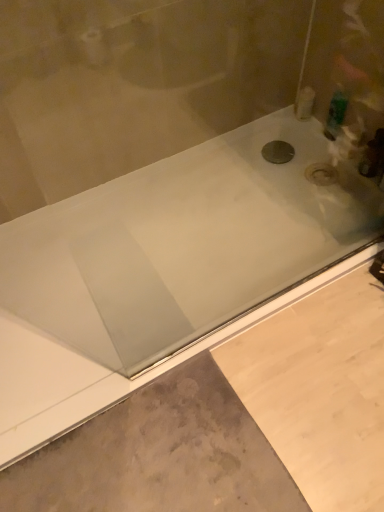
The image size is (384, 512). Identify the location of free space to the left of black metallic drain at center. (235, 162).